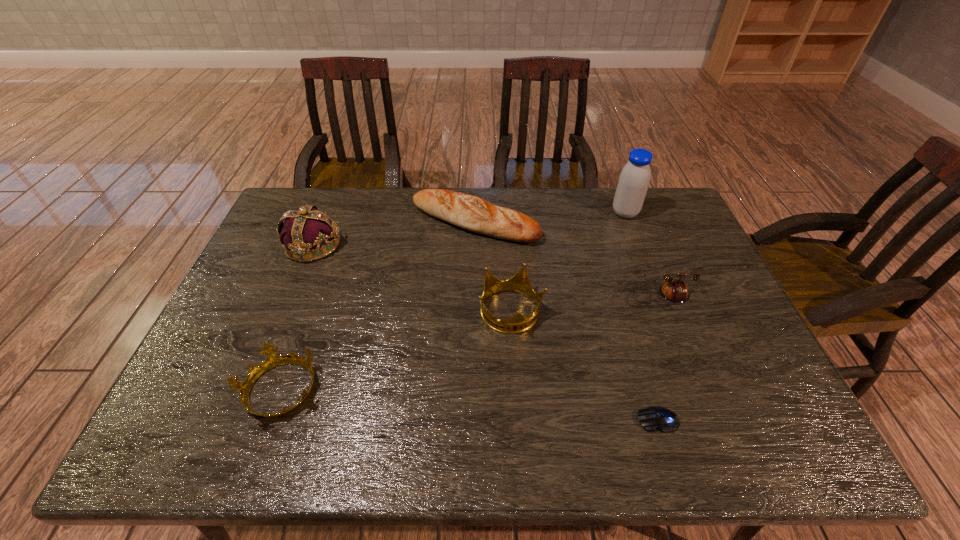
Where is `vacant area at the left edge of the desktop`? vacant area at the left edge of the desktop is located at coordinates (237, 362).

In the image, there is a desktop. At what (x,y) coordinates should I click in order to perform the action: click on vacant space at the right edge. Please return your answer as a coordinate pair (x, y). This screenshot has height=540, width=960. Looking at the image, I should click on (702, 375).

Where is `free point at the near left corner`? free point at the near left corner is located at coordinates (212, 434).

Where is `vacant area between the tallest crown and the computer mouse`? vacant area between the tallest crown and the computer mouse is located at coordinates [x=486, y=332].

Where is `unoccupied area between the nearest crown and the soya milk`? unoccupied area between the nearest crown and the soya milk is located at coordinates (452, 302).

You are a GUI agent. You are given a task and a screenshot of the screen. Output one action in this format:
    pyautogui.click(x=<x>, y=<y>)
    Task: Click on the empty space between the second farthest crown and the shortest object
    This screenshot has width=960, height=540.
    Given the screenshot: What is the action you would take?
    pyautogui.click(x=585, y=366)

Where is `free space between the telephone and the second tallest crown`? The width and height of the screenshot is (960, 540). free space between the telephone and the second tallest crown is located at coordinates (586, 305).

This screenshot has height=540, width=960. What are the coordinates of `blank region between the nearest crown and the computer mouse` in the screenshot? It's located at (468, 406).

In order to click on vacant region between the computer mouse and the nearest crown in this screenshot , I will do `click(468, 406)`.

Image resolution: width=960 pixels, height=540 pixels. Find the location of `vacant area that lies between the baguet and the telephone`. vacant area that lies between the baguet and the telephone is located at coordinates (567, 259).